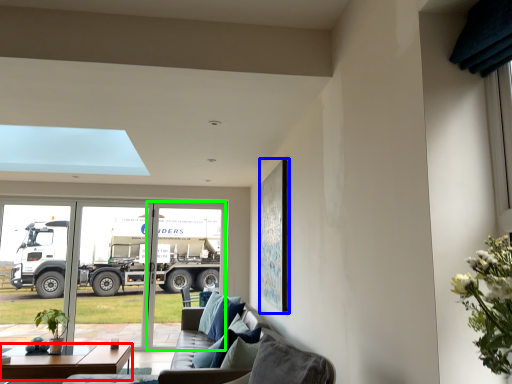
Question: Based on their relative distances, which object is farther from table (highlighted by a red box)? Choose from picture frame (highlighted by a blue box) and screen door (highlighted by a green box).

Choices:
 (A) picture frame
 (B) screen door

Answer: (B)